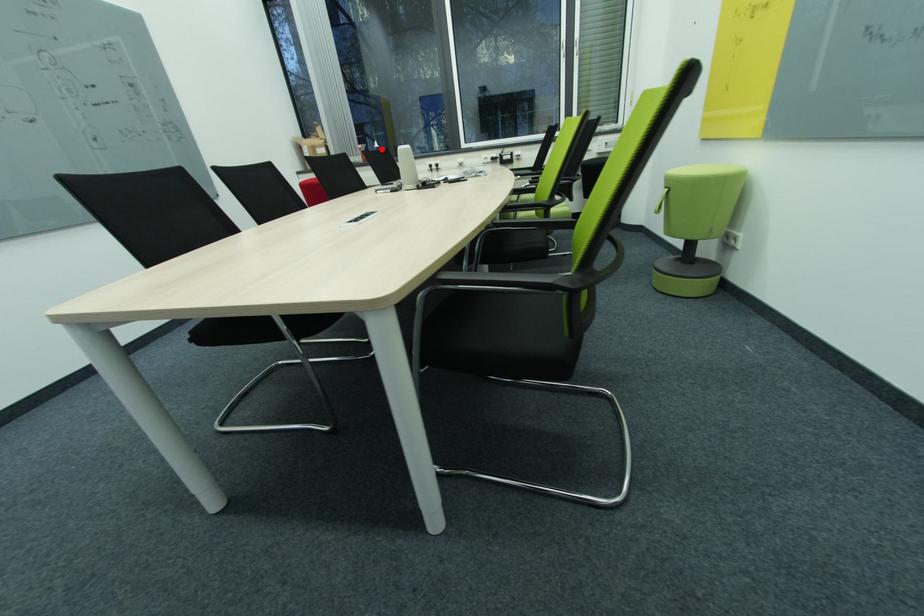
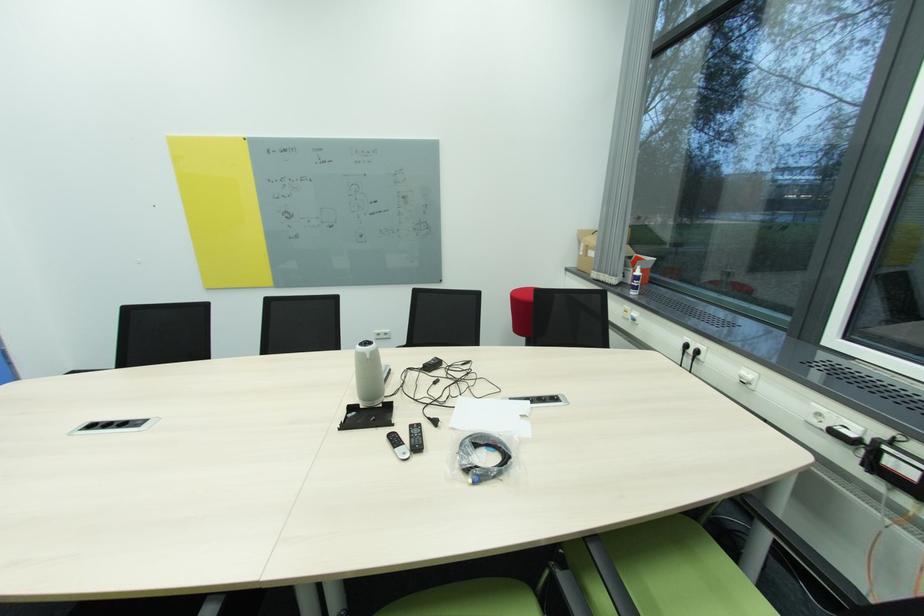
Find the pixel in the second image that matches the highlighted location in the first image.

(639, 277)